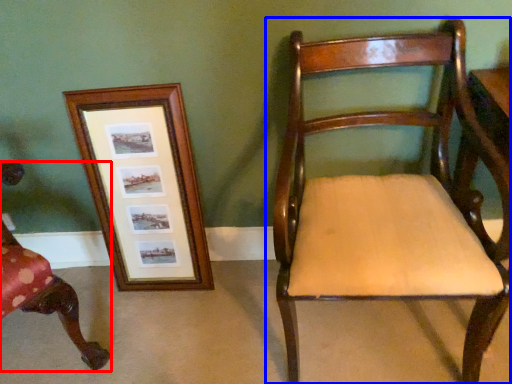
Question: Which of the following is the closest to the observer, chair (highlighted by a red box) or chair (highlighted by a blue box)?

Choices:
 (A) chair
 (B) chair

Answer: (B)